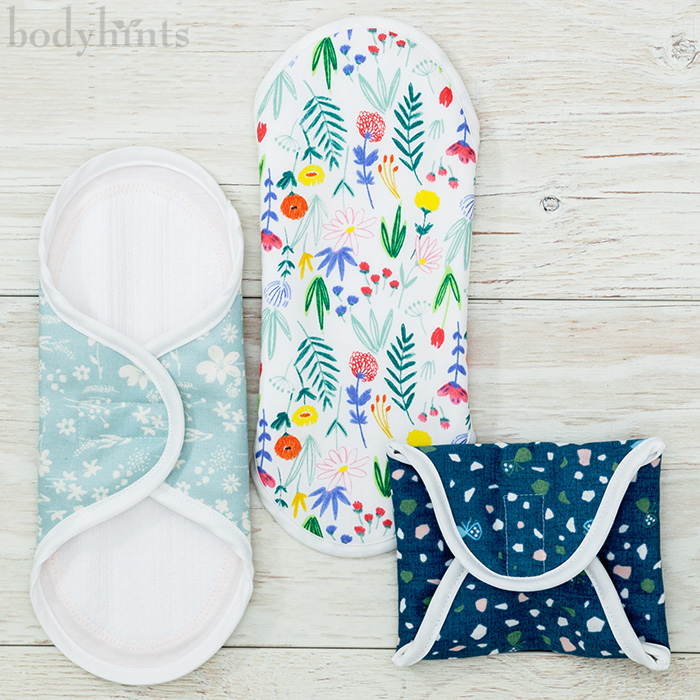
The width and height of the screenshot is (700, 700). What are the coordinates of `plain fabric` in the screenshot? It's located at (164, 582).